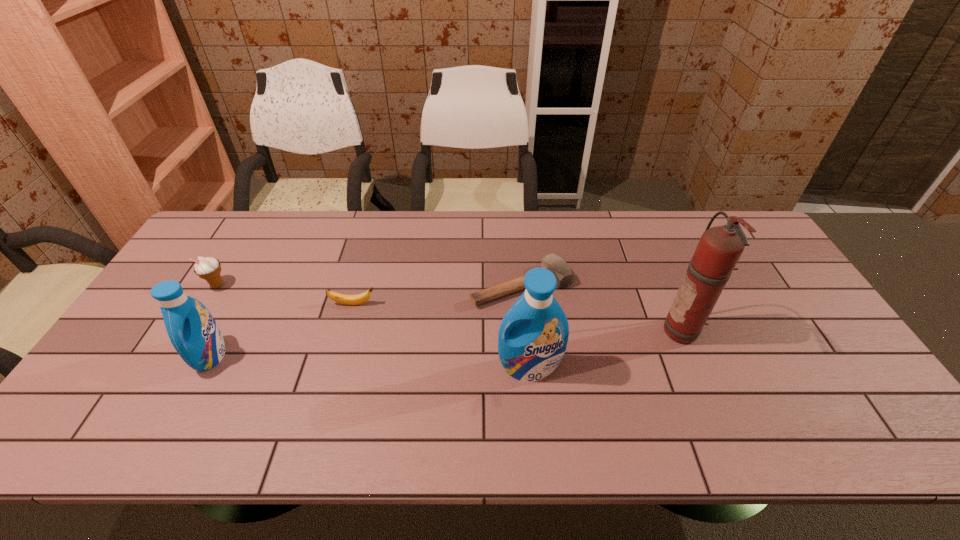
Locate an element on the screen. the shorter detergent is located at coordinates (192, 330).

What are the coordinates of `the fourth shortest object` in the screenshot? It's located at (192, 330).

You are a GUI agent. You are given a task and a screenshot of the screen. Output one action in this format:
    pyautogui.click(x=<x>, y=<y>)
    Task: Click on the right detergent
    The image size is (960, 540).
    Given the screenshot: What is the action you would take?
    click(533, 335)

Locate an element on the screen. The width and height of the screenshot is (960, 540). the taller detergent is located at coordinates (533, 335).

The image size is (960, 540). I want to click on banana, so click(x=358, y=299).

This screenshot has width=960, height=540. What are the coordinates of `the fourth object from right to left` in the screenshot? It's located at (358, 299).

This screenshot has width=960, height=540. Find the location of `fire extinguisher`. fire extinguisher is located at coordinates (719, 249).

Find the location of a particular element. the tallest object is located at coordinates (719, 249).

At what (x,y) coordinates should I click in order to perform the action: click on icecream. Please return your answer as a coordinate pair (x, y). The height and width of the screenshot is (540, 960). Looking at the image, I should click on (209, 268).

Find the location of a particular element. The image size is (960, 540). the leftmost object is located at coordinates (209, 268).